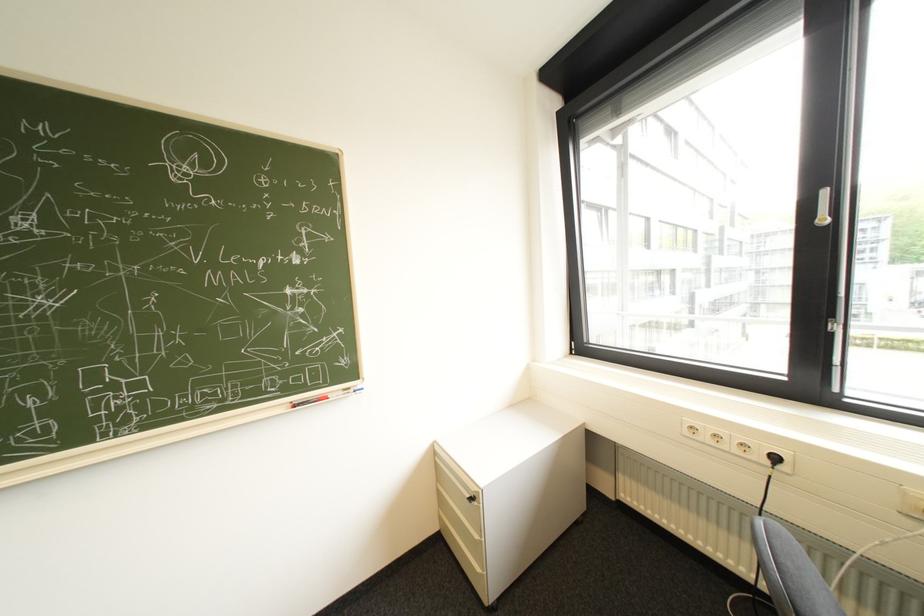
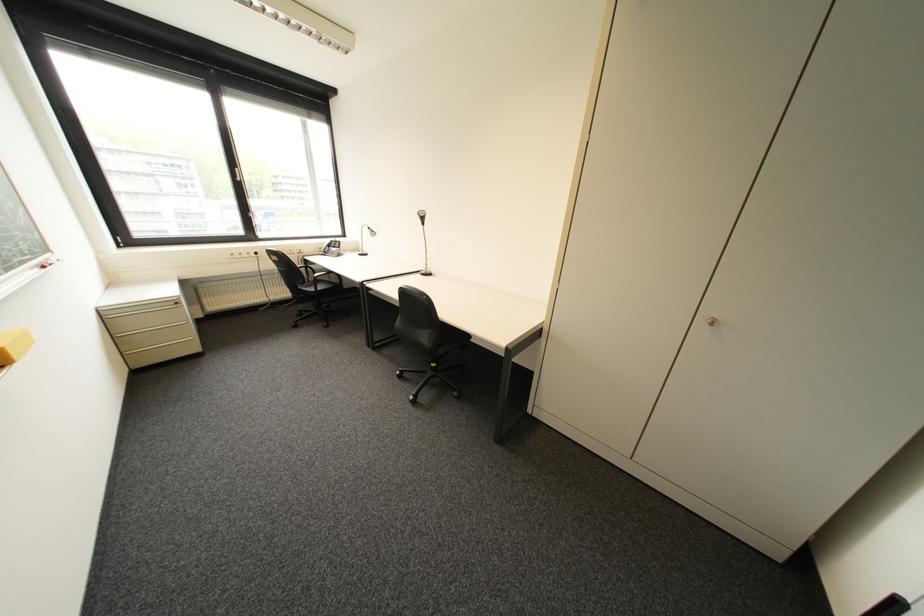
Find the pixel in the second image that matches the point at 833,222 in the first image.

(249, 180)